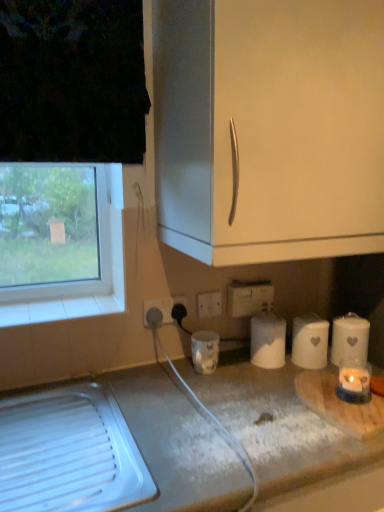
Question: From the image's perspective, is white plastic electric outlet at lower center, the first electric outlet positioned from the front, above or below white matte paper towel at lower right, the 1th paper towel when ordered from right to left?

Choices:
 (A) above
 (B) below

Answer: (A)

Question: Do you think white plastic electric outlet at lower center, the 1th electric outlet in the left-to-right sequence, is within white matte paper towel at lower right, which ranks as the 3th paper towel in left-to-right order, or outside of it?

Choices:
 (A) outside
 (B) inside

Answer: (A)

Question: Estimate the real-world distances between objects in this image. Which object is farther from the white matte paper towel at lower right, the 1th paper towel when ordered from right to left?

Choices:
 (A) transparent glass window at left
 (B) wooden cutting board at lower right
 (C) white matte countertop at lower center
 (D) white plastic electric outlet at lower center, the 2th electric outlet from the front
 (E) white matte paper towel at lower right, marked as the second paper towel in a right-to-left arrangement

Answer: (A)

Question: Which object is positioned farthest from the white plastic power plugs and sockets at lower center?

Choices:
 (A) white matte paper towel at lower right, marked as the second paper towel in a right-to-left arrangement
 (B) white ceramic candle at lower center
 (C) white matte paper towel at center, the third paper towel when ordered from right to left
 (D) white plastic electric outlet at lower center, which ranks as the 2th electric outlet in left-to-right order
 (E) white plastic electric outlet at lower center, the 1th electric outlet in the left-to-right sequence

Answer: (A)